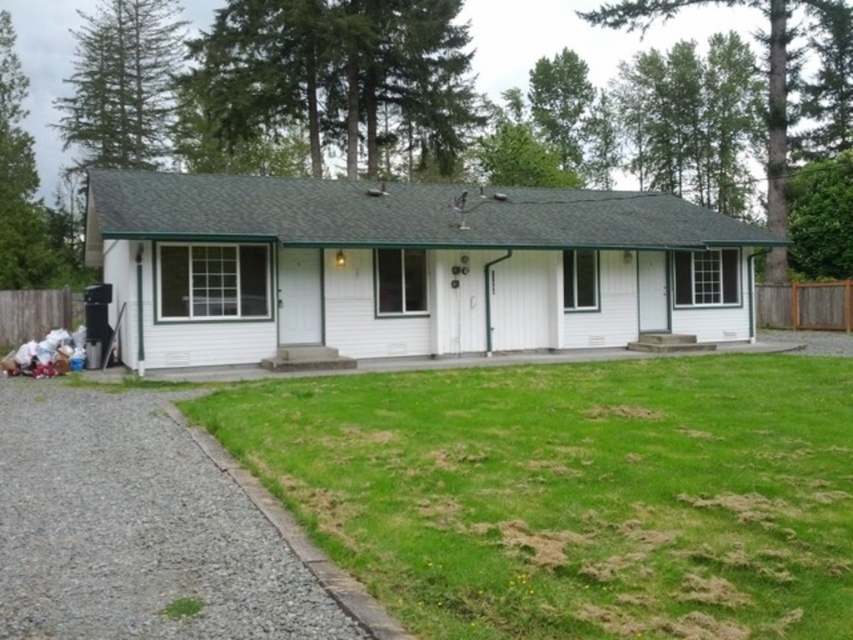
You are a gardener planning to mow the lawn. You see the green grass at lower center and the gray gravel driveway at lower left. Which area should you avoid mowing?

You should avoid mowing the gray gravel driveway at lower left because the green grass at lower center is in front of it, indicating the driveway is a non grassy area.